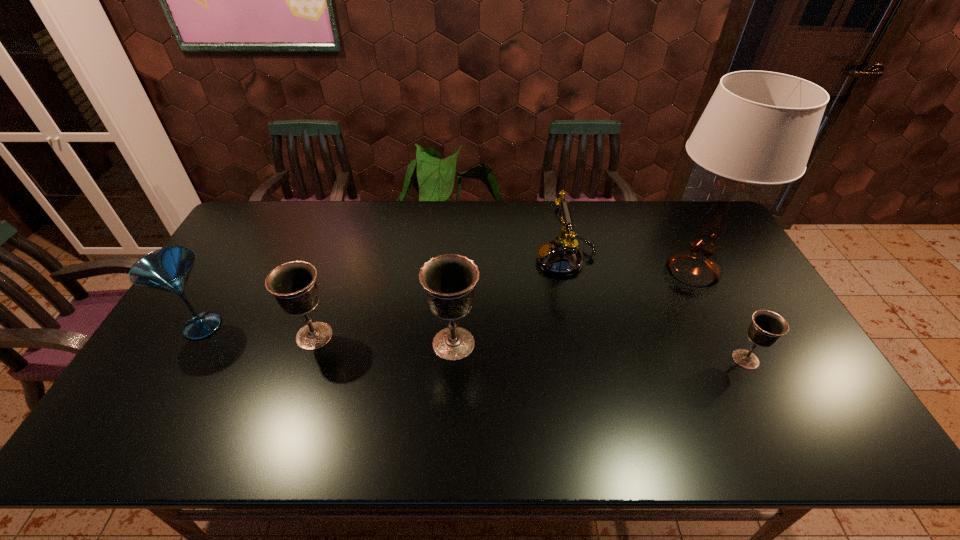
In order to click on vacant position for inserting another chalice evenly in this screenshot , I will do `click(597, 352)`.